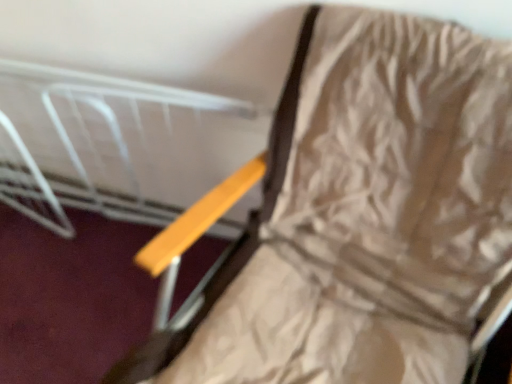
The height and width of the screenshot is (384, 512). What do you see at coordinates (115, 145) in the screenshot?
I see `yellow wood bed at upper center` at bounding box center [115, 145].

This screenshot has height=384, width=512. What are the coordinates of `yellow wood bed at upper center` in the screenshot? It's located at (115, 145).

Identify the location of yellow wood bed at upper center. The height and width of the screenshot is (384, 512). (115, 145).